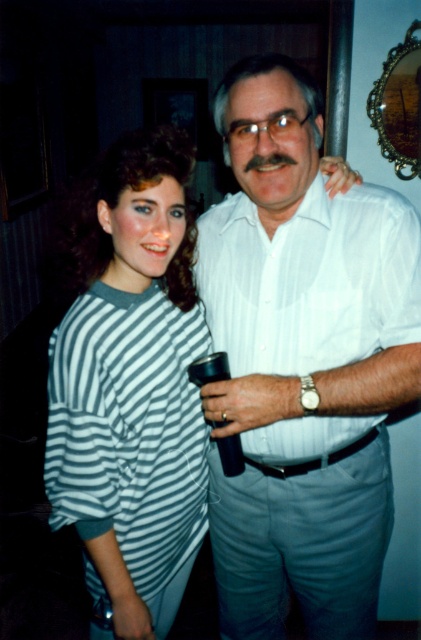
You are standing in front of the image and want to know the exact position of the striped fabric shirt at center. Can you determine its location based on the coordinates provided?

The striped fabric shirt at center is located at point (x=130, y=385).